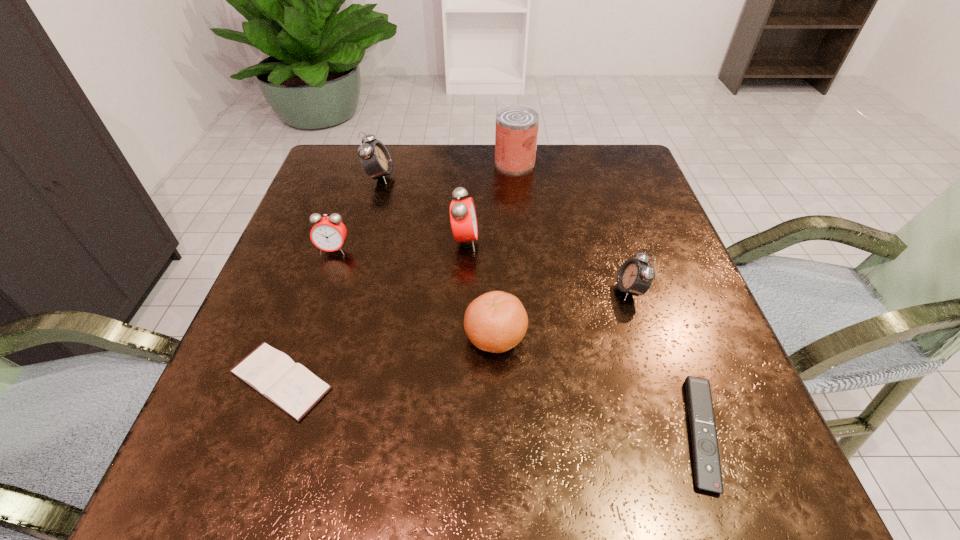
Locate an element on the screen. can is located at coordinates (516, 133).

Locate an element on the screen. the bigger white alarm clock is located at coordinates (375, 159).

In order to click on the left white alarm clock in this screenshot , I will do `click(375, 159)`.

Find the location of a particular element. Image resolution: width=960 pixels, height=540 pixels. the right red alarm clock is located at coordinates (463, 219).

In order to click on the bigger red alarm clock in this screenshot , I will do `click(463, 219)`.

This screenshot has width=960, height=540. I want to click on the smaller white alarm clock, so click(635, 277).

You are a GUI agent. You are given a task and a screenshot of the screen. Output one action in this format:
    pyautogui.click(x=<x>, y=<y>)
    Task: Click on the nearer white alarm clock
    
    Given the screenshot: What is the action you would take?
    pyautogui.click(x=635, y=277)

You are a GUI agent. You are given a task and a screenshot of the screen. Output one action in this format:
    pyautogui.click(x=<x>, y=<y>)
    Task: Click on the smaller red alarm clock
    
    Given the screenshot: What is the action you would take?
    point(328,233)

Find the location of a particular element. The width and height of the screenshot is (960, 540). clementine is located at coordinates (496, 321).

Identify the location of diary. This screenshot has height=540, width=960. (290, 386).